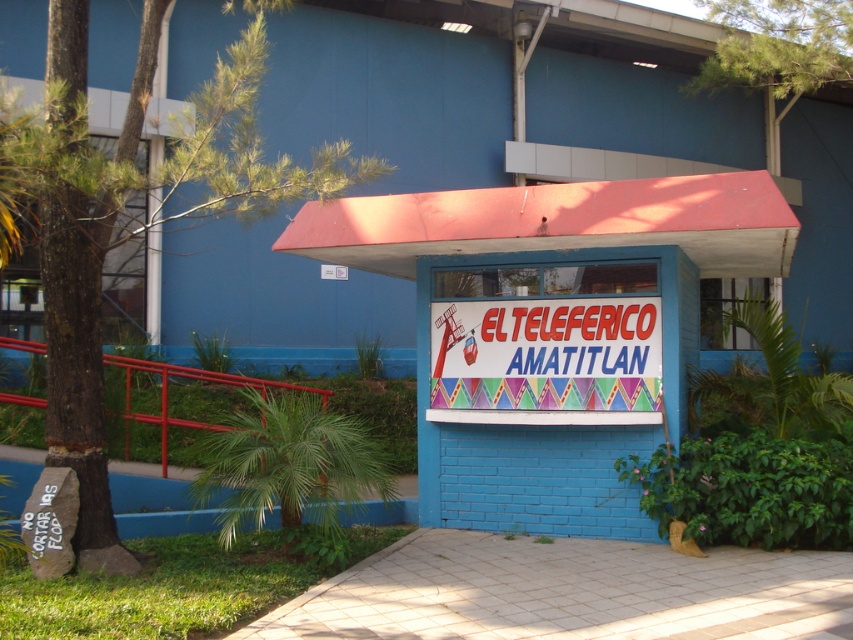
Is point (712, 230) positioned after point (555, 403)?

No, it is not.

Who is taller, blue painted brick sign at center or colorful plastic sign at center?

blue painted brick sign at center is taller.

Image resolution: width=853 pixels, height=640 pixels. What do you see at coordinates (552, 328) in the screenshot? I see `blue painted brick sign at center` at bounding box center [552, 328].

Where is `blue painted brick sign at center`? This screenshot has height=640, width=853. blue painted brick sign at center is located at coordinates (552, 328).